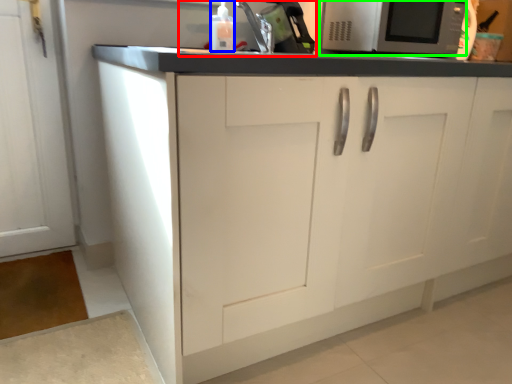
Question: Which object is positioned closest to sink (highlighted by a red box)? Select from bottle (highlighted by a blue box) and microwave oven (highlighted by a green box).

Choices:
 (A) bottle
 (B) microwave oven

Answer: (A)